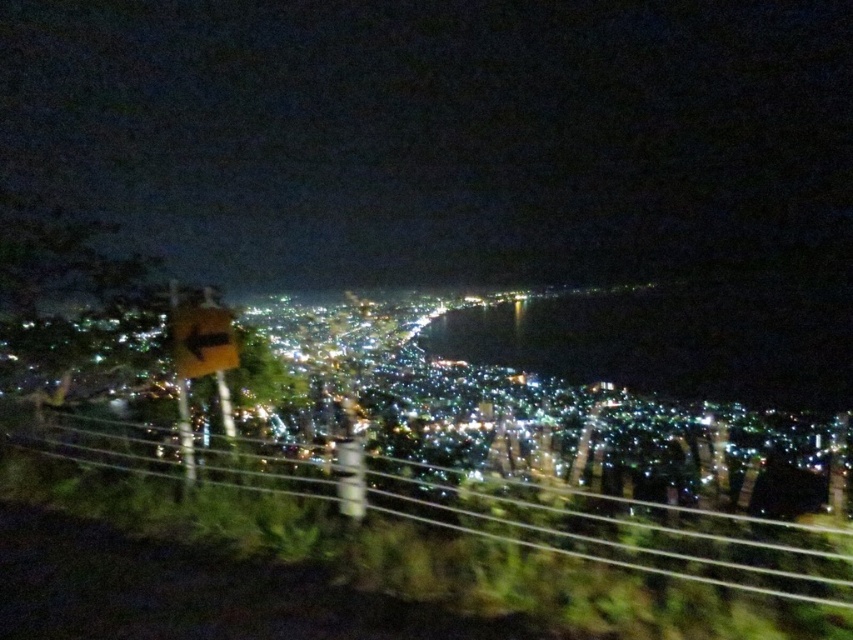
You are a photographer who wants to capture the city lights in the background. You notice the metallic wire fence at lower center and the yellow matte sign at lower left are blocking your view. Which object should you move closer to in order to frame the city lights better?

The metallic wire fence at lower center is much taller than the yellow matte sign at lower left. To frame the city lights better, you should move closer to the yellow matte sign at lower left to avoid its obstruction since it is shorter.

Based on the photo, you are standing in the city at night and see the metallic wire fence at lower center and the yellow matte sign at lower left. Which object is positioned to the right of the other?

The metallic wire fence at lower center is to the right of the yellow matte sign at lower left.

You are a photographer who just took a picture of a city at night. You want to know if the metallic wire fence at lower center is located at the point with coordinates (630, 534). Can you confirm this?

Yes, the metallic wire fence at lower center is represented by point (630, 534).